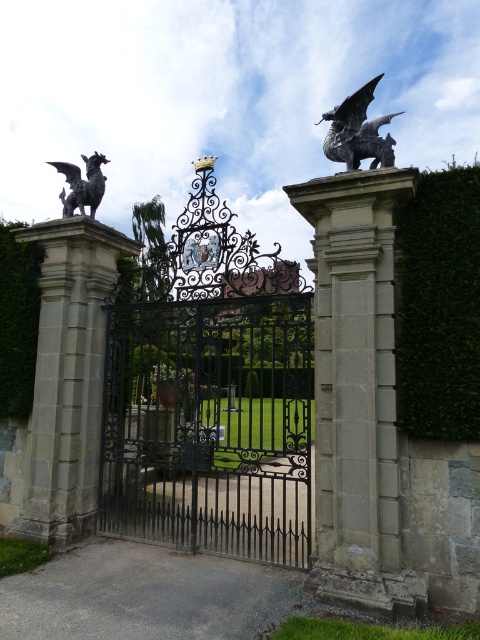
Question: Does green leafy hedge at left appear on the right side of black polished stone gargoyle at left?

Choices:
 (A) no
 (B) yes

Answer: (A)

Question: Does green leafy hedge at right appear on the right side of black polished stone gargoyle at left?

Choices:
 (A) yes
 (B) no

Answer: (A)

Question: Which object is the farthest from the black polished stone gargoyle at left?

Choices:
 (A) black wrought iron gate at center
 (B) green leafy hedge at left
 (C) green leafy hedge at right

Answer: (C)

Question: Is black wrought iron gate at center in front of black polished stone gargoyle at left?

Choices:
 (A) yes
 (B) no

Answer: (A)

Question: Which object is farther from the camera taking this photo?

Choices:
 (A) black polished stone gargoyle at left
 (B) green leafy hedge at right

Answer: (A)

Question: Which point is farther to the camera?

Choices:
 (A) pyautogui.click(x=448, y=218)
 (B) pyautogui.click(x=29, y=268)
 (C) pyautogui.click(x=63, y=209)

Answer: (C)